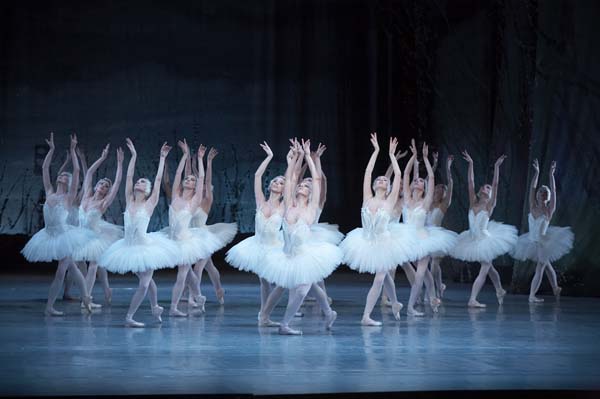
The image size is (600, 399). What are the coordinates of `smooth blue floor` in the screenshot? It's located at pyautogui.click(x=288, y=355).